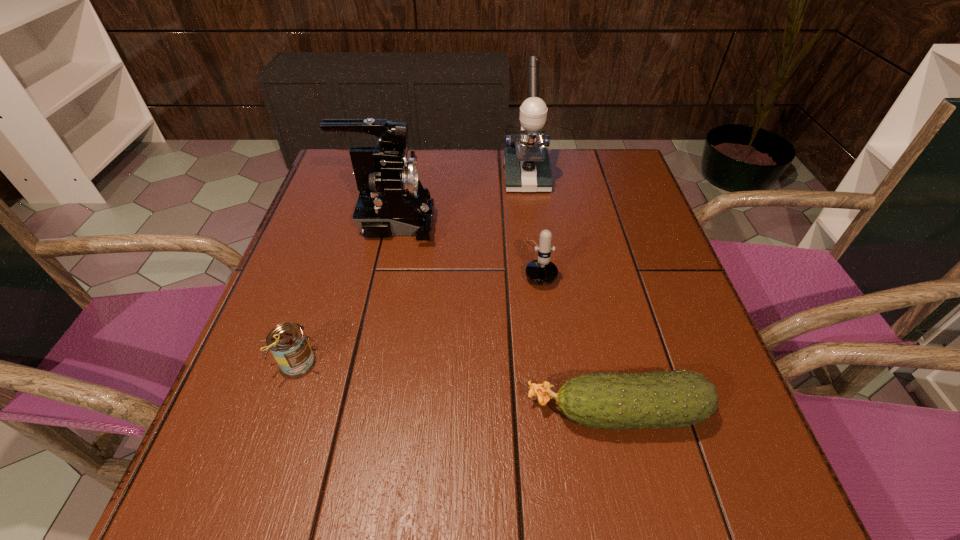
Where is `vacant area located at the blossom end of the cucumber`? The image size is (960, 540). vacant area located at the blossom end of the cucumber is located at coordinates (315, 411).

Find the location of a particular element. This screenshot has height=540, width=960. free spot located at the blossom end of the cucumber is located at coordinates (491, 411).

Where is `vacant space located at the blossom end of the cucumber`? vacant space located at the blossom end of the cucumber is located at coordinates pos(424,411).

Where is `object at the far edge`? The width and height of the screenshot is (960, 540). object at the far edge is located at coordinates (527, 167).

The width and height of the screenshot is (960, 540). Identify the location of camcorder that is at the left edge. (392, 201).

Locate an element on the screen. The height and width of the screenshot is (540, 960). can situated at the left edge is located at coordinates (288, 343).

I want to click on object that is at the right edge, so click(x=678, y=398).

In the image, there is a desktop. Where is `vacant area at the far edge`? The height and width of the screenshot is (540, 960). vacant area at the far edge is located at coordinates (x=459, y=188).

Find the location of a particular element. Image resolution: width=960 pixels, height=540 pixels. vacant space at the near edge of the desktop is located at coordinates 592,463.

You are a GUI agent. You are given a task and a screenshot of the screen. Output one action in this format:
    pyautogui.click(x=<x>, y=<y>)
    Task: Click on the vacant space at the left edge of the desktop
    The height and width of the screenshot is (540, 960).
    Given the screenshot: What is the action you would take?
    pyautogui.click(x=268, y=410)